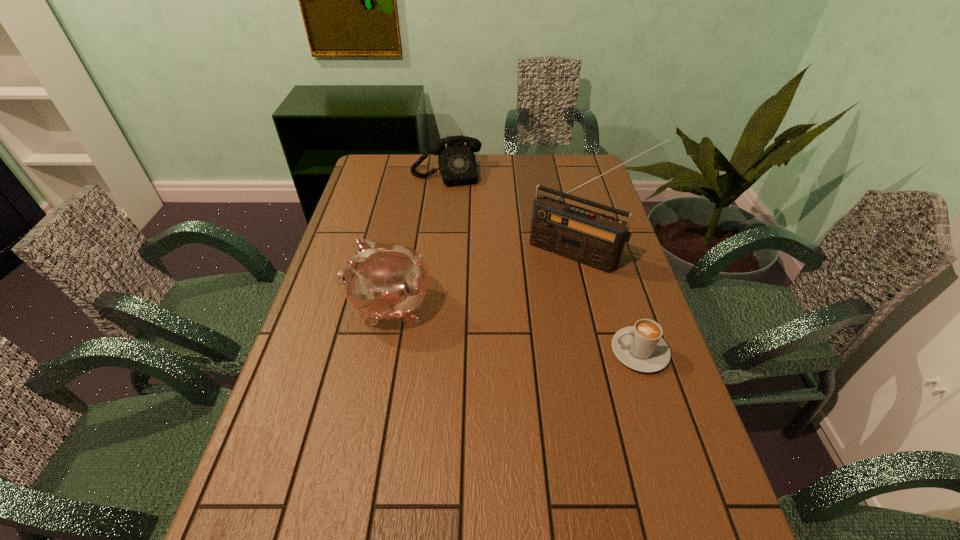
The height and width of the screenshot is (540, 960). In order to click on piggy bank in this screenshot , I will do pyautogui.click(x=382, y=281).

Identify the location of the shortest object. (640, 347).

Locate an element on the screen. The image size is (960, 540). the farthest object is located at coordinates (457, 163).

Locate an element on the screen. The height and width of the screenshot is (540, 960). telephone is located at coordinates (457, 163).

Locate an element on the screen. the third nearest object is located at coordinates (590, 238).

Where is `radio receiver`? Image resolution: width=960 pixels, height=540 pixels. radio receiver is located at coordinates (590, 238).

The image size is (960, 540). In order to click on vacant region located 0.070m on the front facing side of the piggy bank in this screenshot , I will do `click(322, 307)`.

Find the location of a particular element. The image size is (960, 540). vacant space positioned 0.300m to the right of the shortest object is located at coordinates (492, 351).

Where is `vacant region located 0.390m to the right of the shortest object`? The height and width of the screenshot is (540, 960). vacant region located 0.390m to the right of the shortest object is located at coordinates (456, 351).

This screenshot has height=540, width=960. What are the coordinates of `vacant position located to the right of the shortest object` in the screenshot? It's located at (460, 351).